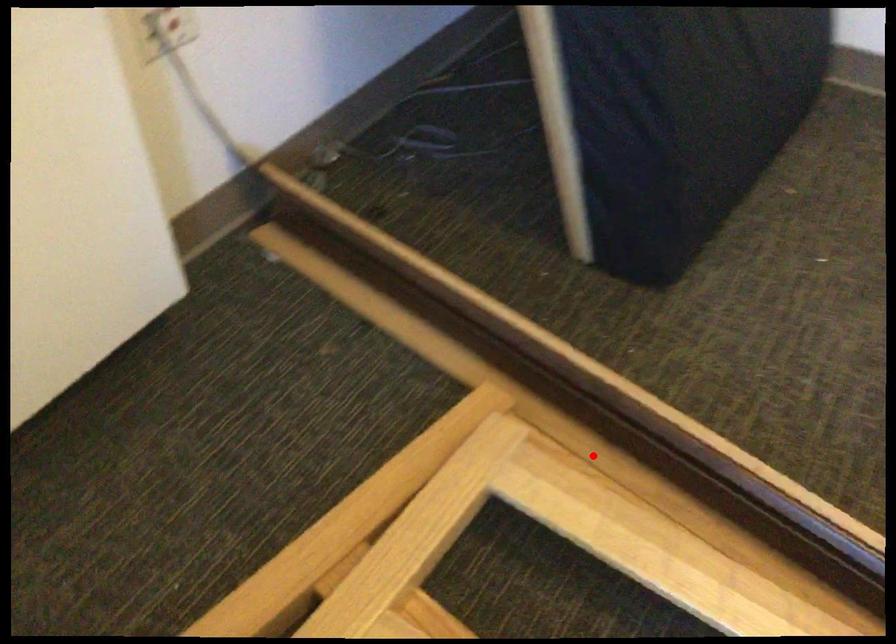
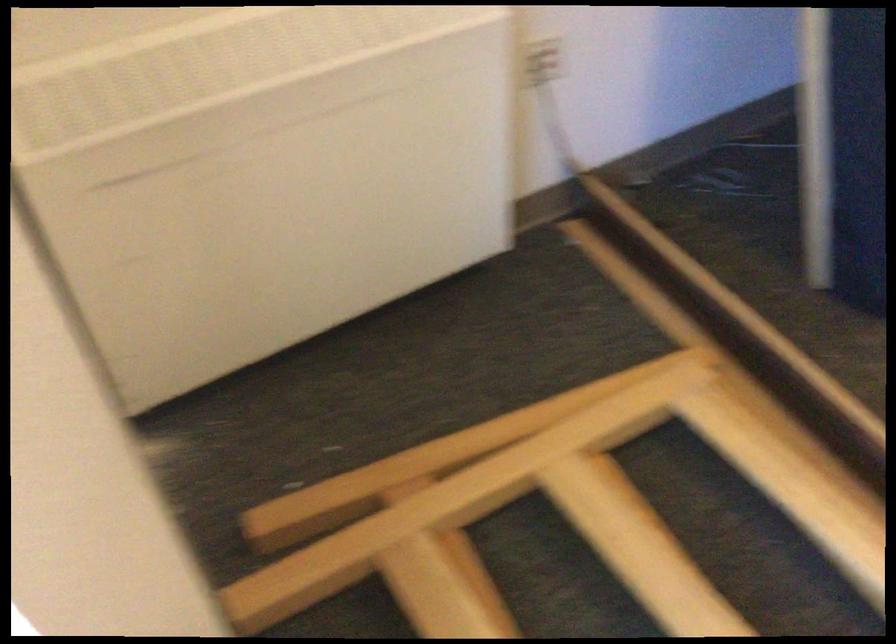
Locate, in the second image, the point that corresponds to the highlighted location in the first image.

(777, 418)